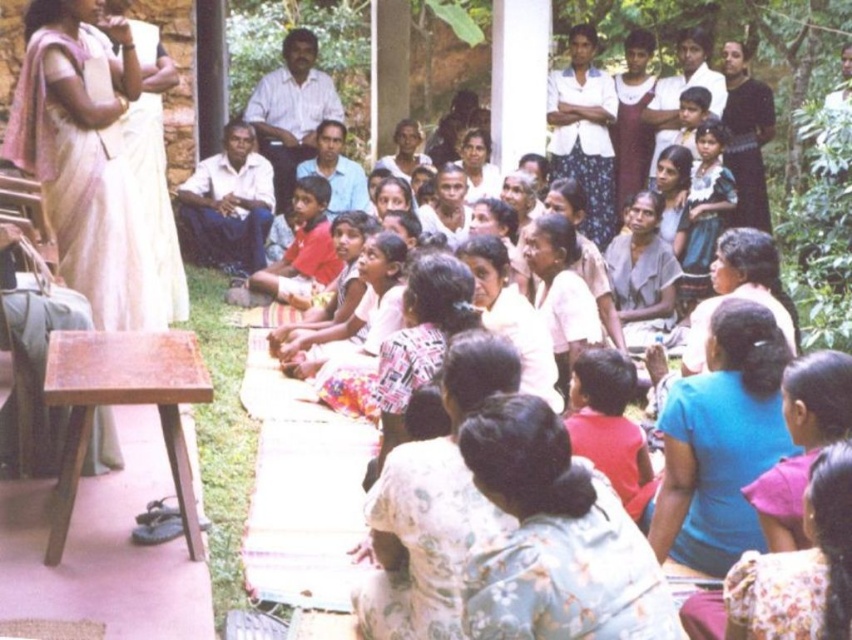
You are an event organizer who needs to arrange seating for attendees. The floral fabric dress at center and the blue fabric shirt at lower right are part of the audience. Which attendee requires more space due to their clothing?

The floral fabric dress at center requires more space because its width is larger than the blue fabric shirt at lower right.

You are a photographer trying to capture a photo of the white cotton shirt at center and the blue fabric shirt at lower right. Can you position yourself so that both shirts are visible in the frame without any obstruction?

The blue fabric shirt at lower right is located below the white cotton shirt at center, so yes, you can position yourself to capture both shirts in the frame as they are vertically aligned with the white cotton shirt at center above the blue fabric shirt at lower right.

You are part of the audience sitting on the mat and notice two people at the front of the scene. One is wearing a floral fabric dress at center and the other a white cotton shirt at center. Which one is positioned closer to the ground?

The floral fabric dress at center is located below the white cotton shirt at center, so the person wearing the floral fabric dress at center is positioned closer to the ground.